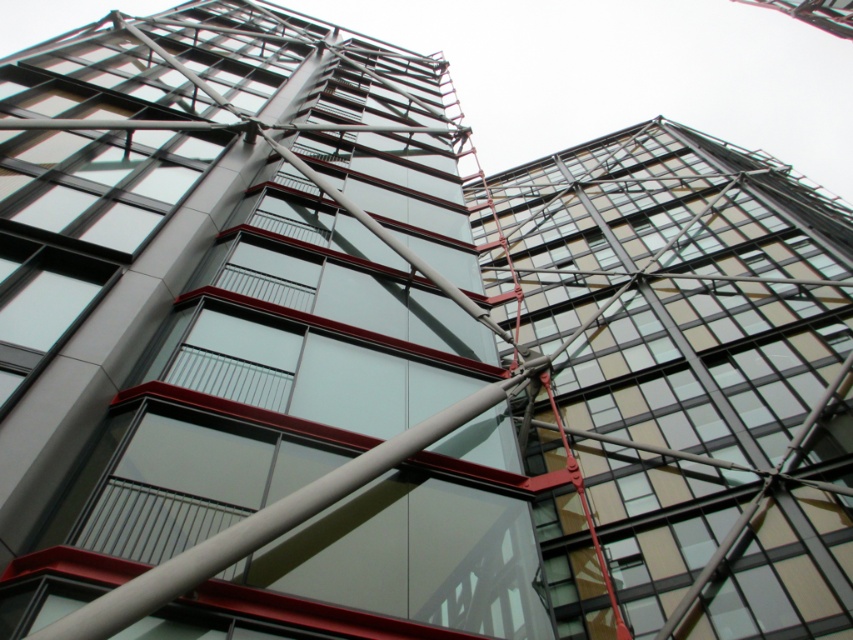
In the scene shown: Between glassy steel tower at center and transparent glass building at upper right, which one is positioned lower?

Positioned lower is transparent glass building at upper right.

At what (x,y) coordinates should I click in order to perform the action: click on glassy steel tower at center. Please return your answer as a coordinate pair (x, y). This screenshot has height=640, width=853. Looking at the image, I should click on (247, 333).

Describe the element at coordinates (247, 333) in the screenshot. I see `glassy steel tower at center` at that location.

You are a GUI agent. You are given a task and a screenshot of the screen. Output one action in this format:
    pyautogui.click(x=<x>, y=<y>)
    Task: Click on the glassy steel tower at center
    
    Given the screenshot: What is the action you would take?
    pyautogui.click(x=247, y=333)